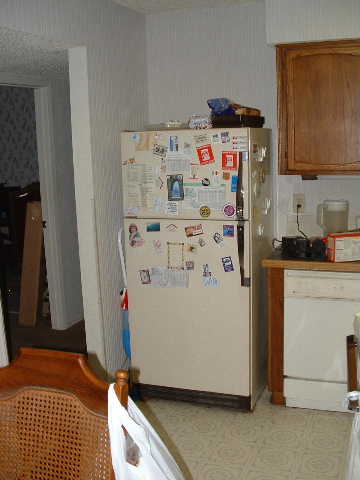
Where is `plastic water jug`? This screenshot has width=360, height=480. plastic water jug is located at coordinates (333, 220).